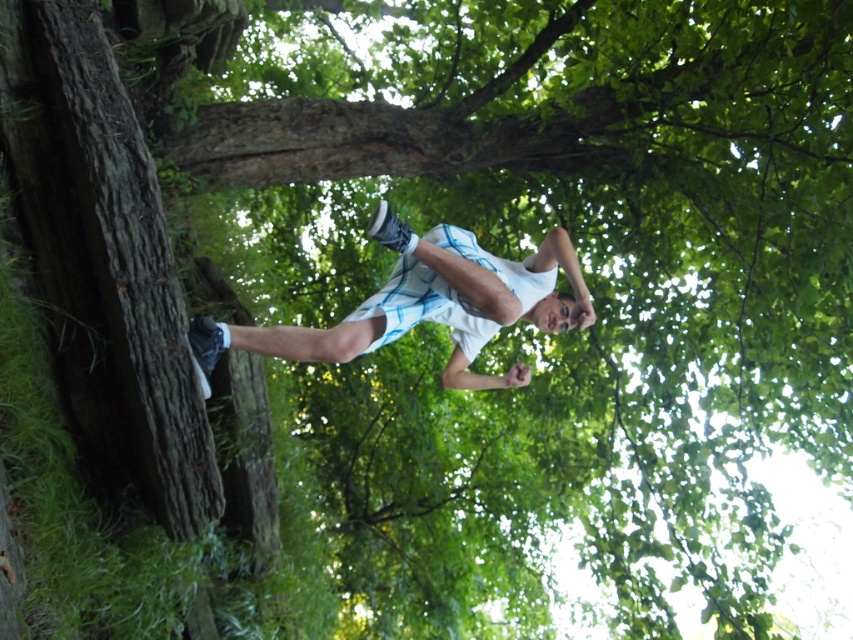
Question: Which point is farther to the camera?

Choices:
 (A) white matte shorts at center
 (B) rough bark tree trunk at left

Answer: (A)

Question: In this image, where is rough bark tree trunk at left located relative to white matte shorts at center?

Choices:
 (A) below
 (B) above

Answer: (B)

Question: Does rough bark tree trunk at left appear on the right side of white matte shorts at center?

Choices:
 (A) no
 (B) yes

Answer: (A)

Question: Among these objects, which one is nearest to the camera?

Choices:
 (A) rough bark tree trunk at left
 (B) white matte shorts at center

Answer: (A)

Question: Does rough bark tree trunk at left appear under white matte shorts at center?

Choices:
 (A) no
 (B) yes

Answer: (A)